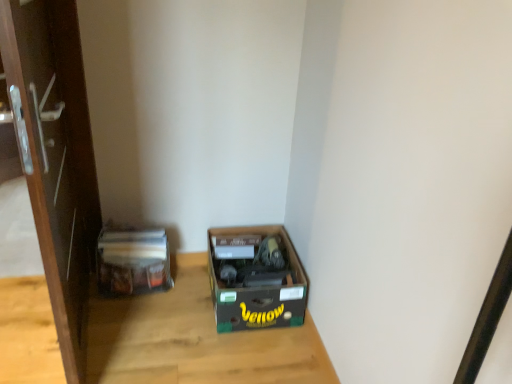
Identify the location of spots to the right of matte plastic bag at left. (186, 297).